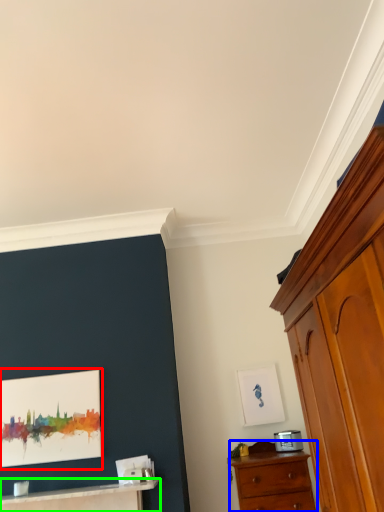
Question: Considering the real-world distances, which object is closest to picture frame (highlighted by a red box)? chest of drawers (highlighted by a blue box) or table (highlighted by a green box).

Choices:
 (A) chest of drawers
 (B) table

Answer: (B)